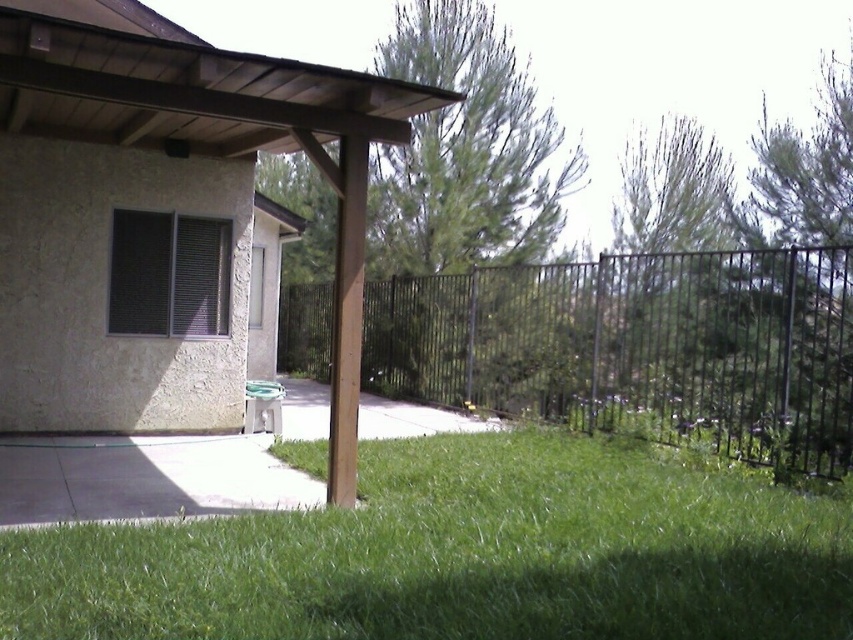
You are standing at the point labeled as point (161, 216) in the image. What object is located exactly at that point?

The point (161, 216) corresponds to the brown wood pergola at center.

You are planning to install a new rectangular garden bed in the residential outdoor scene. The garden bed requires a space wider than the brown wood pergola at center. Can the green grass at lower center accommodate this requirement?

The green grass at lower center has a larger width than the brown wood pergola at center, so the garden bed requiring a space wider than the pergola can be accommodated on the green grass at lower center.

You are a gardener who needs to mow the lawn. You see the green grass at lower center and the black metal fence at center. Which area is smaller in size?

The green grass at lower center is smaller than the black metal fence at center.